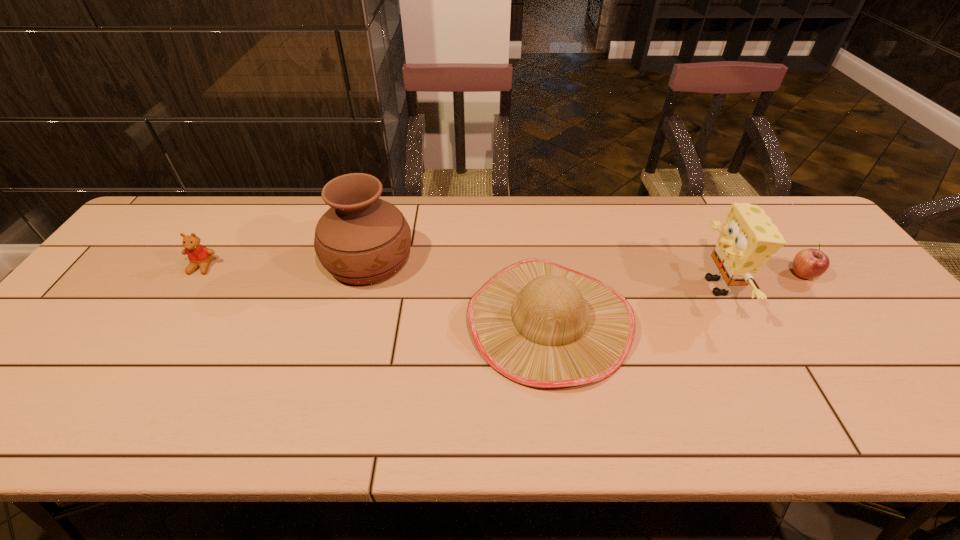
Identify the location of urn. The image size is (960, 540). (361, 239).

Image resolution: width=960 pixels, height=540 pixels. Identify the location of sponge. (748, 239).

In order to click on sunhat in this screenshot , I will do `click(540, 324)`.

I want to click on the third shortest object, so click(540, 324).

This screenshot has height=540, width=960. I want to click on teddy bear, so click(200, 256).

The height and width of the screenshot is (540, 960). Find the location of `the shortest object`. the shortest object is located at coordinates (809, 263).

Find the location of `apple`. apple is located at coordinates [x=809, y=263].

The image size is (960, 540). Find the location of `vacant space located 0.200m on the left of the fourth object from right to left`. vacant space located 0.200m on the left of the fourth object from right to left is located at coordinates (253, 259).

This screenshot has height=540, width=960. What are the coordinates of `free location located on the face of the sponge` in the screenshot? It's located at (657, 286).

Where is `free spot located 0.060m on the face of the sponge`? This screenshot has width=960, height=540. free spot located 0.060m on the face of the sponge is located at coordinates (675, 286).